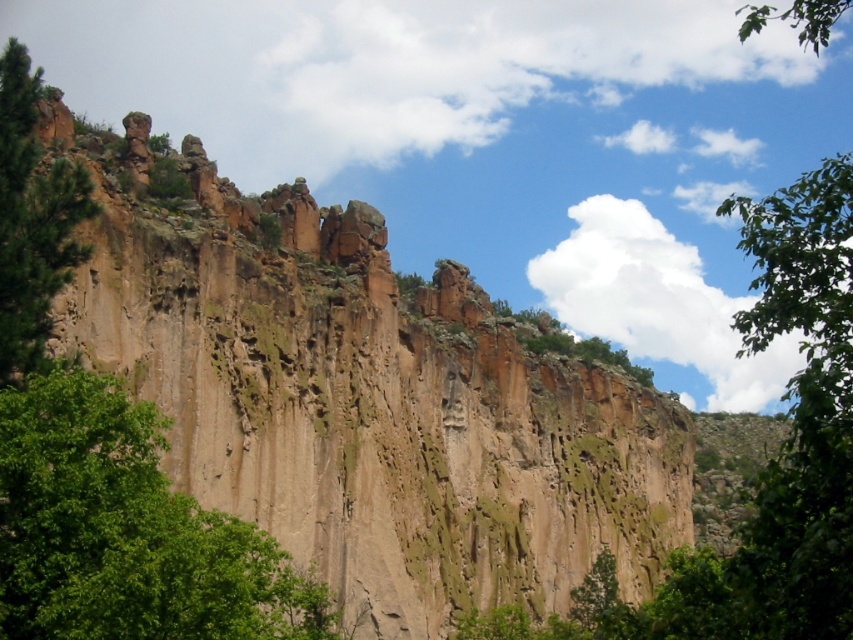
You are standing at the base of the cliff and want to take a photo of the green leafy tree at center. If your camera has a maximum zoom range of 50 meters, will you be able to capture the entire tree in the photo without moving closer?

The green leafy tree at center is 51.84 meters away from the viewer. Since the camera can only zoom up to 50 meters, you won

You are standing in front of the towering cliff and notice two points marked on the cliff face. The first point is at coordinates point (45,131) and the second is at point (10,38). Which point is closer to your eyes?

Point (10,38) is closer to your eyes because it is less further to the camera than point (45,131).